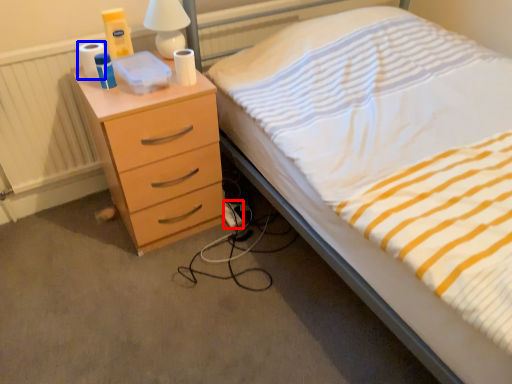
Question: Which point is further to the camera, extension cord (highlighted by a red box) or toilet paper (highlighted by a blue box)?

Choices:
 (A) extension cord
 (B) toilet paper

Answer: (A)